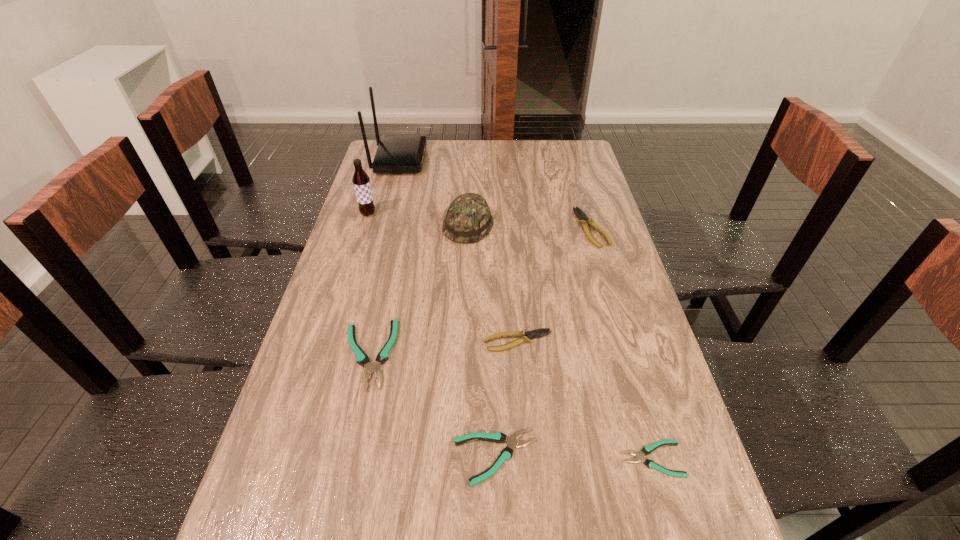
Identify the location of router. This screenshot has width=960, height=540. (396, 153).

In order to click on the tallest object in this screenshot , I will do point(396,153).

Find the location of `root beer`. root beer is located at coordinates (361, 181).

Where is `brown root beer`? This screenshot has width=960, height=540. brown root beer is located at coordinates (361, 181).

At what (x,y) coordinates should I click in order to perform the action: click on headwear. Please return your answer as a coordinate pair (x, y). The height and width of the screenshot is (540, 960). Looking at the image, I should click on (468, 219).

Locate an element on the screen. The height and width of the screenshot is (540, 960). the fifth shortest object is located at coordinates (583, 219).

Locate an element on the screen. the tallest pliers is located at coordinates (583, 219).

Find the location of a particular element. the leftmost pliers is located at coordinates (362, 359).

Locate an element on the screen. the farthest teal pliers is located at coordinates (362, 359).

You are a GUI agent. You are given a task and a screenshot of the screen. Output one action in this format:
    pyautogui.click(x=<x>, y=<y>)
    Task: Click on the left yellow pliers
    
    Given the screenshot: What is the action you would take?
    pyautogui.click(x=525, y=336)